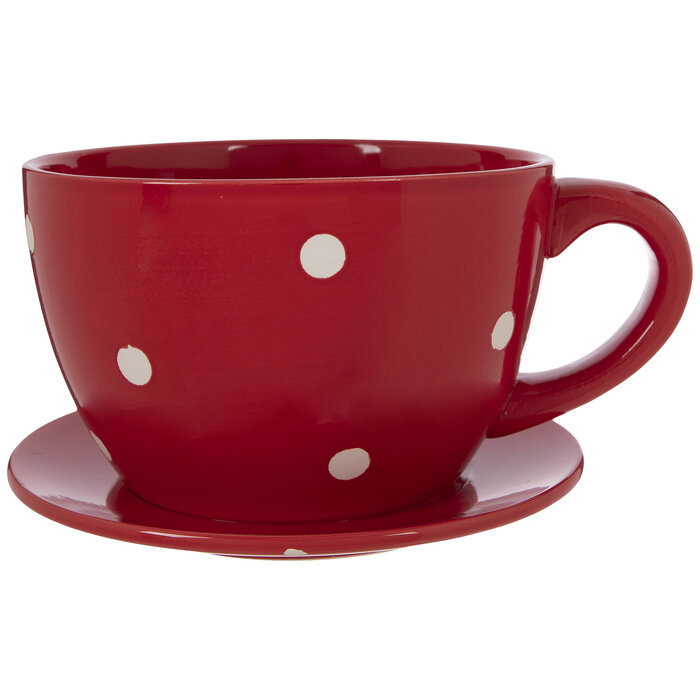
Locate an element on the screen. rim of cup is located at coordinates (386, 180).